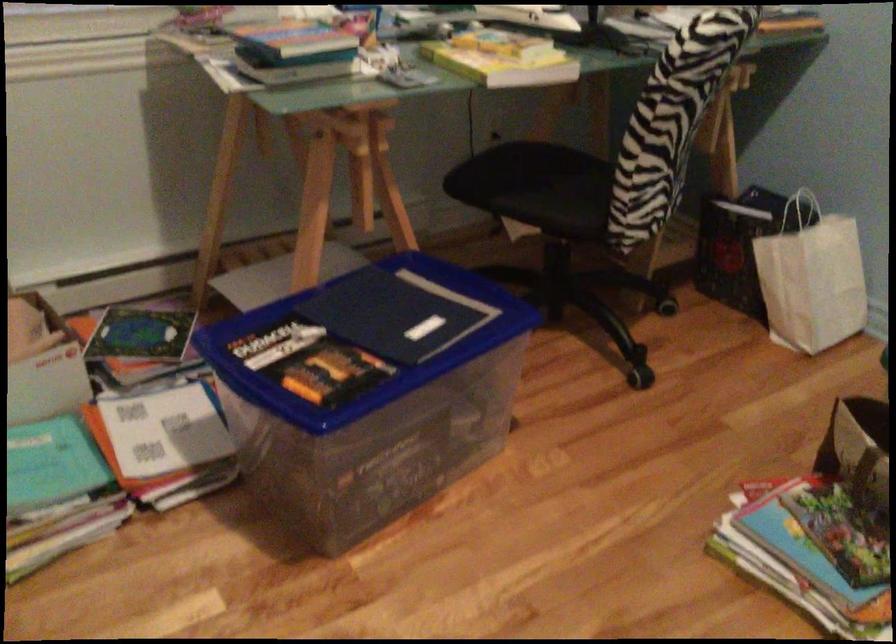
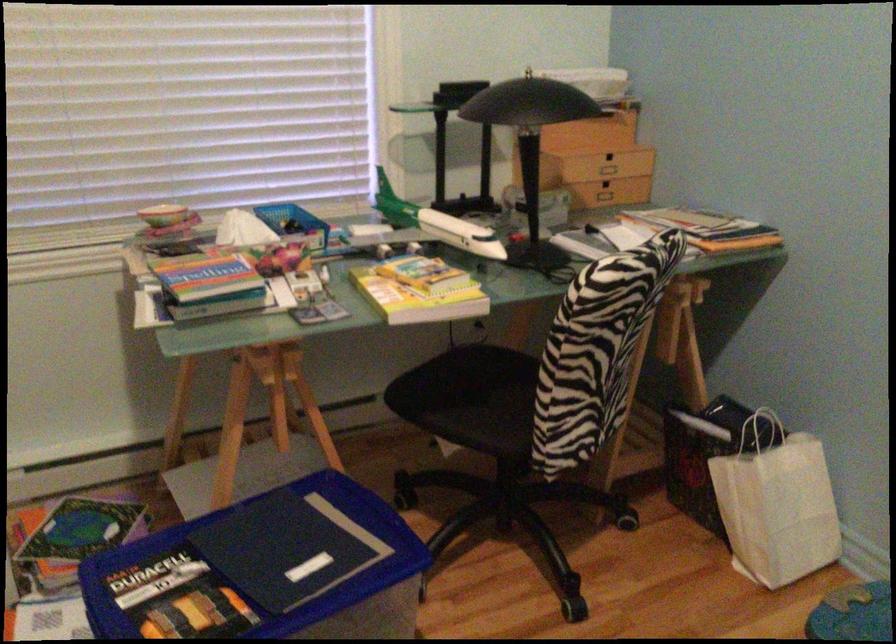
Where in the second image is the point corresponding to (424,317) from the first image?

(316, 551)